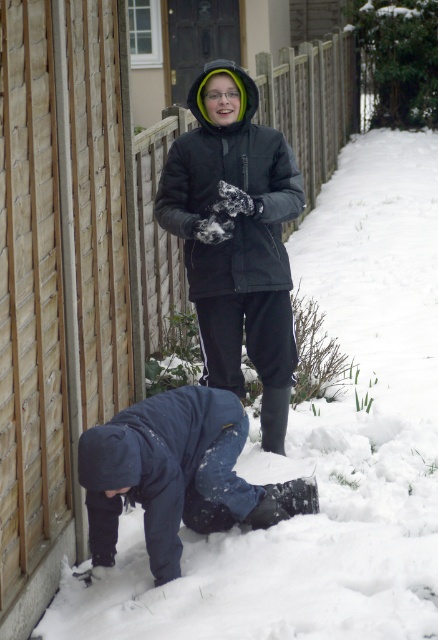
Between point (279, 300) and point (176, 448), which one is positioned behind?

The point (279, 300) is more distant.

Is point (229, 88) farther from viewer compared to point (222, 493)?

Yes.

This screenshot has height=640, width=438. I want to click on matte black jacket at center, so click(x=236, y=237).